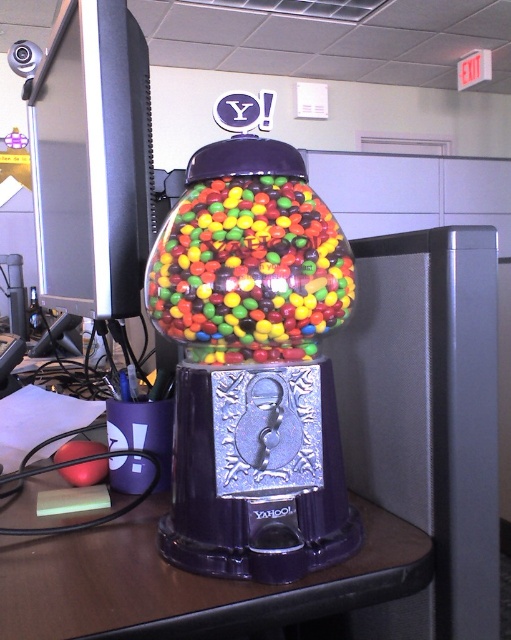
Question: Which object appears closest to the camera in this image?

Choices:
 (A) shiny multicolored gumballs at center
 (B) purple glossy table at center

Answer: (B)

Question: Among these objects, which one is farthest from the camera?

Choices:
 (A) shiny multicolored gumballs at center
 (B) purple glossy table at center

Answer: (A)

Question: Which object is closer to the camera taking this photo?

Choices:
 (A) purple glossy table at center
 (B) shiny multicolored gumballs at center

Answer: (A)

Question: Can you confirm if purple glossy table at center is positioned to the left of shiny multicolored gumballs at center?

Choices:
 (A) no
 (B) yes

Answer: (B)

Question: From the image, what is the correct spatial relationship of purple glossy table at center in relation to shiny multicolored gumballs at center?

Choices:
 (A) left
 (B) right

Answer: (A)

Question: Observing the image, what is the correct spatial positioning of purple glossy table at center in reference to shiny multicolored gumballs at center?

Choices:
 (A) right
 (B) left

Answer: (B)